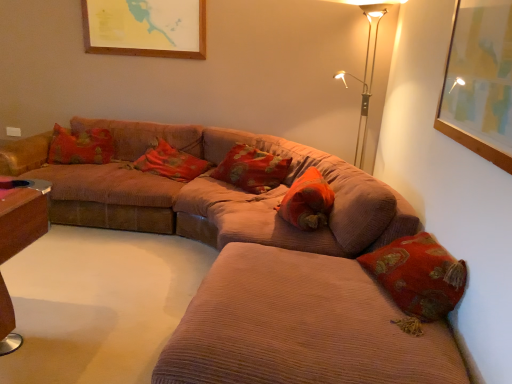
Question: Based on their sizes in the image, would you say red velvet cushion at center, which is the first pillow from right to left, is bigger or smaller than metallic gold floor lamp at upper right?

Choices:
 (A) small
 (B) big

Answer: (A)

Question: Considering the positions of point (309, 213) and point (376, 31), is point (309, 213) closer or farther from the camera than point (376, 31)?

Choices:
 (A) farther
 (B) closer

Answer: (B)

Question: Which is nearer to the brown corduroy couch at center?

Choices:
 (A) matte red pillow at center, the second pillow positioned from the left
 (B) corduroy couch at lower right
 (C) corduroy pillow at center, arranged as the first pillow when viewed from the left
 (D) metallic gold floor lamp at upper right
 (E) red velvet cushion at center, which is the third pillow from left to right

Answer: (A)

Question: Considering the real-world distances, which object is farthest from the metallic gold floor lamp at upper right?

Choices:
 (A) corduroy pillow at center, marked as the third pillow in a right-to-left arrangement
 (B) matte red pillow at center, the 2th pillow in the right-to-left sequence
 (C) red velvet cushion at center, which is the third pillow from left to right
 (D) corduroy couch at lower right
 (E) brown corduroy couch at center

Answer: (D)